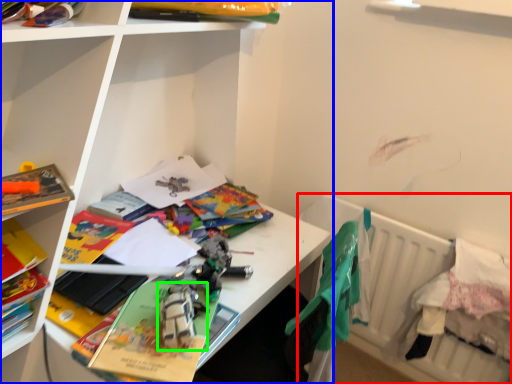
Question: Based on their relative distances, which object is farther from bed (highlighted by a red box)? Choose from shelf (highlighted by a blue box) and toy (highlighted by a green box).

Choices:
 (A) shelf
 (B) toy

Answer: (B)